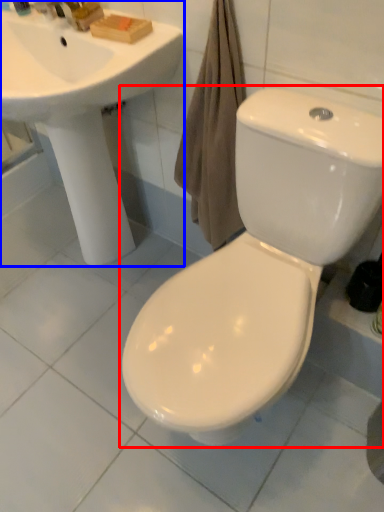
Question: Which object appears closest to the camera in this image, toilet (highlighted by a red box) or sink (highlighted by a blue box)?

Choices:
 (A) toilet
 (B) sink

Answer: (A)